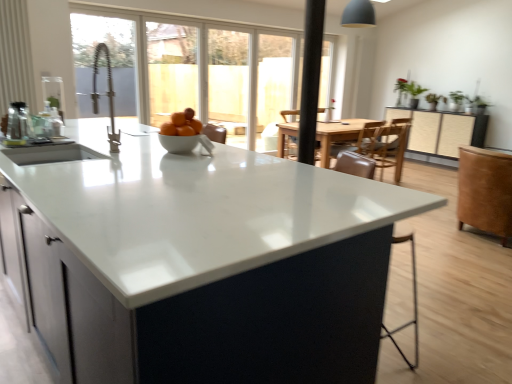
The height and width of the screenshot is (384, 512). I want to click on free space in front of white glossy bowl at center, so click(x=175, y=152).